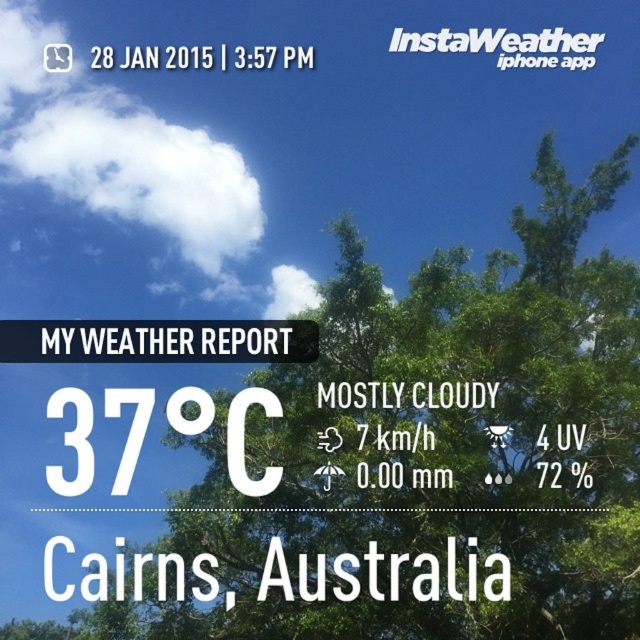
Looking at this image, you are looking at the InstaWeather app on your iPhone. You see a point marked at coordinates (445, 436). Based on the scene, can you tell me what this point is indicating?

The point at coordinates (445, 436) is indicating a green leafy tree at upper center.

Based on the weather report displayed on the InstaWeather app, what is the current temperature and condition? Also, where is the green leafy tree at upper center located in terms of coordinates?

The current temperature is 37 degrees Celsius, and the condition is MOSTLY C. The green leafy tree at upper center is located at coordinates (x=445, y=436).